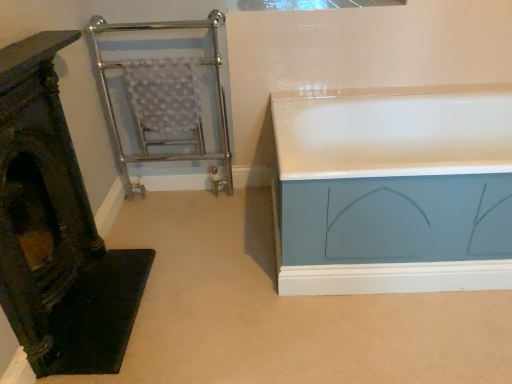
Question: Is white glossy bathtub at right far from wooden carved chair at left?

Choices:
 (A) yes
 (B) no

Answer: (B)

Question: Are white glossy bathtub at right and wooden carved chair at left making contact?

Choices:
 (A) yes
 (B) no

Answer: (B)

Question: Does white glossy bathtub at right appear on the left side of wooden carved chair at left?

Choices:
 (A) no
 (B) yes

Answer: (A)

Question: Is white glossy bathtub at right to the right of wooden carved chair at left from the viewer's perspective?

Choices:
 (A) no
 (B) yes

Answer: (B)

Question: Is the depth of white glossy bathtub at right less than that of wooden carved chair at left?

Choices:
 (A) yes
 (B) no

Answer: (B)

Question: Is white glossy bathtub at right thinner than wooden carved chair at left?

Choices:
 (A) yes
 (B) no

Answer: (B)

Question: From a real-world perspective, is chrome/metal towel rack at left physically above white glossy bathtub at right?

Choices:
 (A) yes
 (B) no

Answer: (A)

Question: Is chrome/metal towel rack at left thinner than white glossy bathtub at right?

Choices:
 (A) no
 (B) yes

Answer: (B)

Question: From the image's perspective, is chrome/metal towel rack at left on top of white glossy bathtub at right?

Choices:
 (A) yes
 (B) no

Answer: (A)

Question: From a real-world perspective, is chrome/metal towel rack at left located beneath white glossy bathtub at right?

Choices:
 (A) yes
 (B) no

Answer: (B)

Question: Is there a large distance between chrome/metal towel rack at left and white glossy bathtub at right?

Choices:
 (A) yes
 (B) no

Answer: (B)

Question: From the image's perspective, would you say chrome/metal towel rack at left is shown under white glossy bathtub at right?

Choices:
 (A) no
 (B) yes

Answer: (A)

Question: Does transparent glass window at upper center appear on the right side of wooden carved chair at left?

Choices:
 (A) no
 (B) yes

Answer: (B)